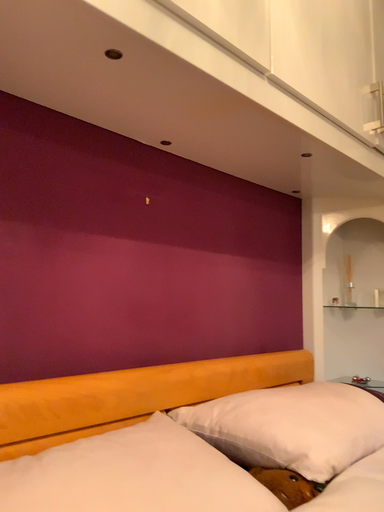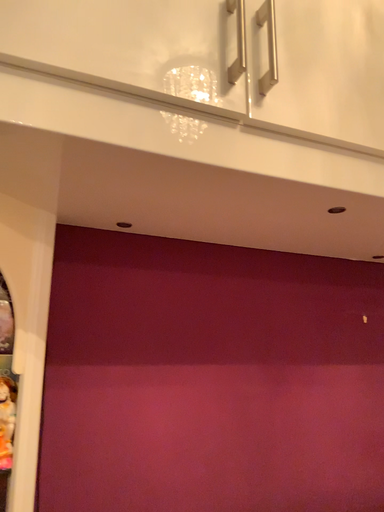
Question: How did the camera likely rotate when shooting the video?

Choices:
 (A) rotated left
 (B) rotated right

Answer: (A)